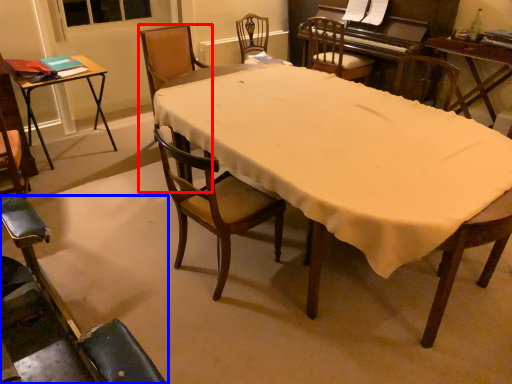
Question: Which object is further to the camera taking this photo, chair (highlighted by a red box) or chair (highlighted by a blue box)?

Choices:
 (A) chair
 (B) chair

Answer: (A)